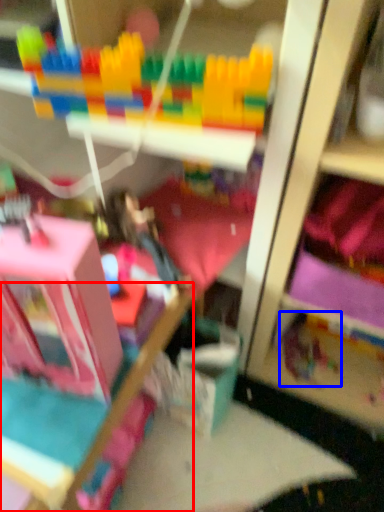
Question: Among these objects, which one is farthest to the camera, bed frame (highlighted by a red box) or toy (highlighted by a blue box)?

Choices:
 (A) bed frame
 (B) toy

Answer: (B)